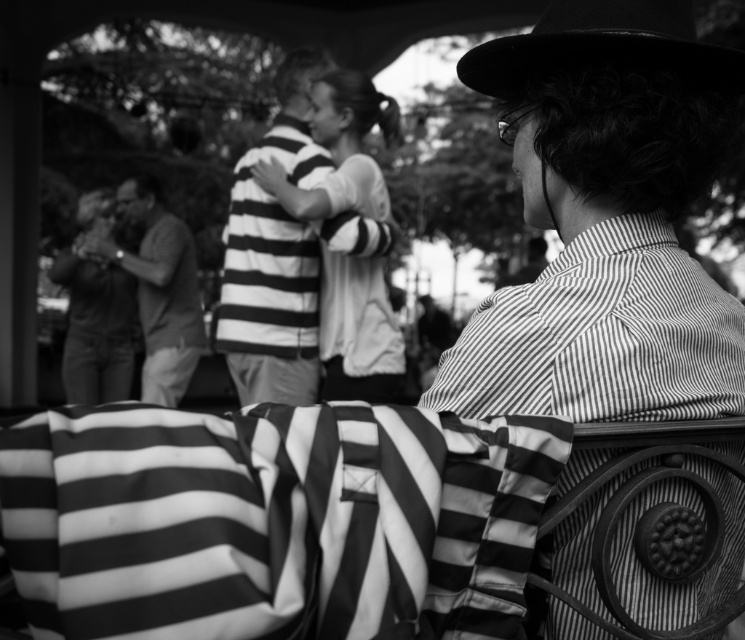
Does striped fabric shirt at center appear over black felt hat at upper right?

Yes, striped fabric shirt at center is above black felt hat at upper right.

Identify the location of striped fabric shirt at center. This screenshot has height=640, width=745. (273, 253).

Does striped fabric shirt at center appear over striped shirt at left?

Indeed, striped fabric shirt at center is positioned over striped shirt at left.

Who is more distant from viewer, [240,381] or [164,227]?

Positioned behind is point [164,227].

Find the location of a particular element. This screenshot has width=745, height=640. striped fabric shirt at center is located at coordinates (273, 253).

Between black felt hat at upper right and striped shirt at left, which one has more height?

striped shirt at left

Does black felt hat at upper right appear on the left side of striped shirt at left?

No, black felt hat at upper right is not to the left of striped shirt at left.

Find the location of a particular element. Image resolution: width=745 pixels, height=640 pixels. black felt hat at upper right is located at coordinates (602, 44).